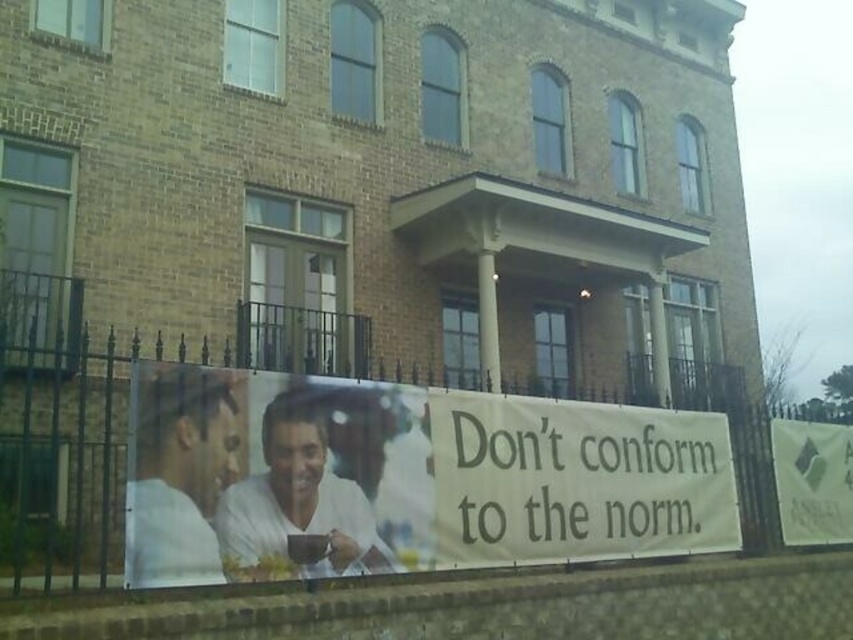
Question: Is the position of white paper banner at center more distant than that of green fabric sign at lower right?

Choices:
 (A) no
 (B) yes

Answer: (A)

Question: Can you confirm if white paper banner at center is positioned above green fabric sign at lower right?

Choices:
 (A) no
 (B) yes

Answer: (B)

Question: Which of the following is the closest to the observer?

Choices:
 (A) (782, 440)
 (B) (688, 538)

Answer: (B)

Question: Among these points, which one is farthest from the camera?

Choices:
 (A) (776, 436)
 (B) (630, 483)

Answer: (A)

Question: Is white paper banner at center above green fabric sign at lower right?

Choices:
 (A) no
 (B) yes

Answer: (B)